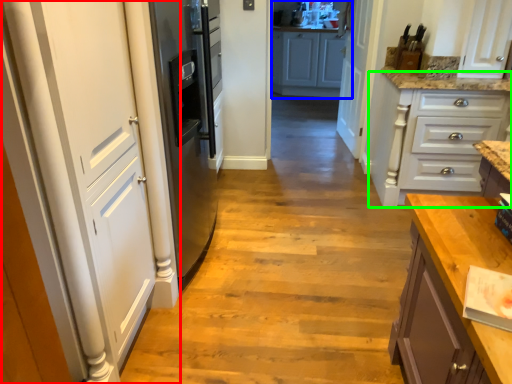
Question: Which object is positioned farthest from door (highlighted by a red box)? Select from cabinetry (highlighted by a blue box) and cabinetry (highlighted by a green box).

Choices:
 (A) cabinetry
 (B) cabinetry

Answer: (A)